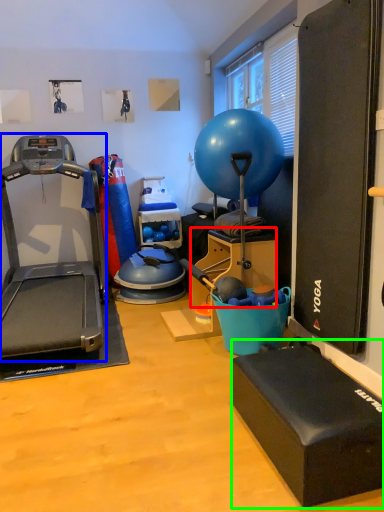
Question: Based on their relative distances, which object is nearer to box (highlighted by a red box)? Choose from treadmill (highlighted by a blue box) and box (highlighted by a green box).

Choices:
 (A) treadmill
 (B) box

Answer: (A)